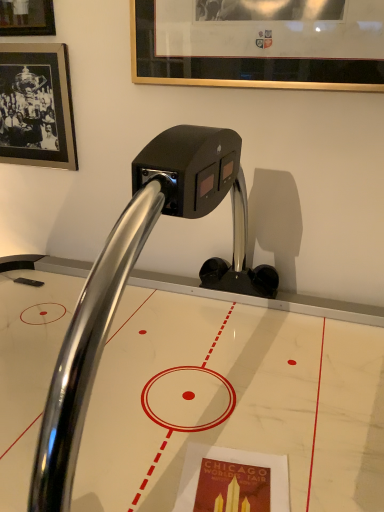
Question: Can you confirm if gold-framed picture at upper center, which is counted as the 1th picture frame, starting from the front, is positioned to the right of polished chrome faucet at center?

Choices:
 (A) yes
 (B) no

Answer: (A)

Question: Considering the relative sizes of gold-framed picture at upper center, marked as the 2th picture frame in a left-to-right arrangement, and polished chrome faucet at center in the image provided, is gold-framed picture at upper center, marked as the 2th picture frame in a left-to-right arrangement, bigger than polished chrome faucet at center?

Choices:
 (A) no
 (B) yes

Answer: (A)

Question: From a real-world perspective, is gold-framed picture at upper center, which is counted as the 1th picture frame, starting from the front, on polished chrome faucet at center?

Choices:
 (A) no
 (B) yes

Answer: (B)

Question: Would you consider gold-framed picture at upper center, arranged as the 2th picture frame when viewed from the back, to be distant from polished chrome faucet at center?

Choices:
 (A) yes
 (B) no

Answer: (B)

Question: Is gold-framed picture at upper center, which is the first picture frame in right-to-left order, taller than polished chrome faucet at center?

Choices:
 (A) yes
 (B) no

Answer: (B)

Question: Considering the relative positions of polished chrome faucet at center and black matte picture frame at upper left, which is the 2th picture frame in front-to-back order, in the image provided, is polished chrome faucet at center to the left or to the right of black matte picture frame at upper left, which is the 2th picture frame in front-to-back order,?

Choices:
 (A) left
 (B) right

Answer: (B)

Question: Considering the positions of polished chrome faucet at center and black matte picture frame at upper left, acting as the 2th picture frame starting from the right, in the image, is polished chrome faucet at center bigger or smaller than black matte picture frame at upper left, acting as the 2th picture frame starting from the right,?

Choices:
 (A) big
 (B) small

Answer: (A)

Question: In terms of width, does polished chrome faucet at center look wider or thinner when compared to black matte picture frame at upper left, the first picture frame viewed from the back?

Choices:
 (A) wide
 (B) thin

Answer: (A)

Question: From the image's perspective, relative to black matte picture frame at upper left, acting as the 2th picture frame starting from the right, is polished chrome faucet at center above or below?

Choices:
 (A) above
 (B) below

Answer: (B)

Question: Relative to polished chrome faucet at center, is black matte picture frame at upper left, acting as the 2th picture frame starting from the right, in front or behind?

Choices:
 (A) behind
 (B) front

Answer: (A)

Question: From the image's perspective, is black matte picture frame at upper left, acting as the 2th picture frame starting from the right, positioned above or below polished chrome faucet at center?

Choices:
 (A) below
 (B) above

Answer: (B)

Question: Is black matte picture frame at upper left, the 1th picture frame when ordered from left to right, bigger or smaller than polished chrome faucet at center?

Choices:
 (A) big
 (B) small

Answer: (B)

Question: Which is correct: black matte picture frame at upper left, the first picture frame viewed from the back, is inside polished chrome faucet at center, or outside of it?

Choices:
 (A) outside
 (B) inside

Answer: (B)

Question: From the image's perspective, is black matte picture frame at upper left, the 1th picture frame when ordered from left to right, located above or below gold-framed picture at upper center, which is the first picture frame in right-to-left order?

Choices:
 (A) below
 (B) above

Answer: (A)

Question: Is black matte picture frame at upper left, the first picture frame viewed from the back, in front of or behind gold-framed picture at upper center, which is counted as the 1th picture frame, starting from the front, in the image?

Choices:
 (A) front
 (B) behind

Answer: (B)